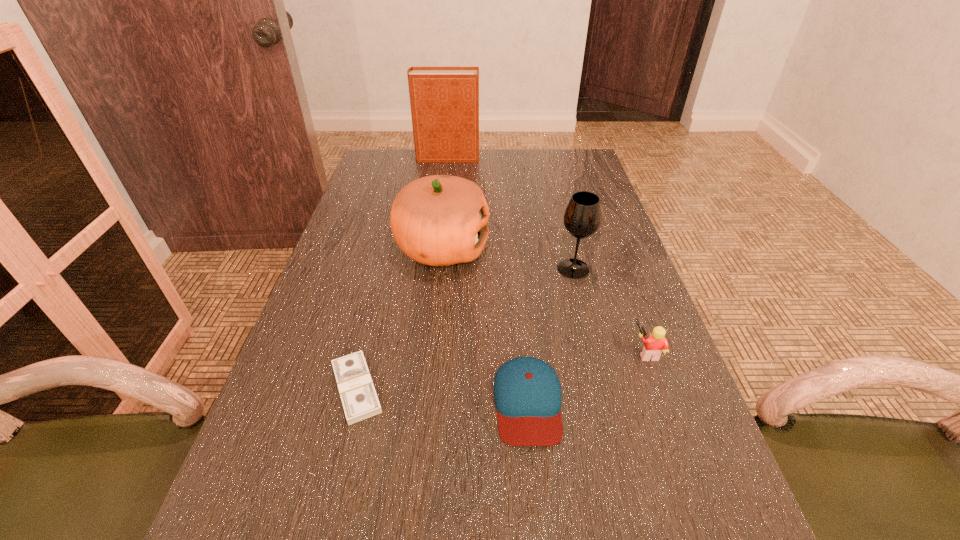
Locate an element on the screen. The image size is (960, 540). dollar located at the left edge is located at coordinates (358, 395).

Where is `wineglass that is at the right edge`? This screenshot has height=540, width=960. wineglass that is at the right edge is located at coordinates (582, 217).

You are a GUI agent. You are given a task and a screenshot of the screen. Output one action in this format:
    pyautogui.click(x=<x>, y=<y>)
    Task: Click on the Lego located at the right edge
    
    Given the screenshot: What is the action you would take?
    pyautogui.click(x=656, y=342)

You are a GUI agent. You are given a task and a screenshot of the screen. Output one action in this format:
    pyautogui.click(x=<x>, y=<y>)
    Task: Click on the object at the far left corner
    This screenshot has width=960, height=540.
    Given the screenshot: What is the action you would take?
    pyautogui.click(x=444, y=101)

Find the location of `vacant point at the far edge`. vacant point at the far edge is located at coordinates (504, 181).

Locate an element on the screen. This screenshot has height=540, width=960. vacant space at the left edge of the desktop is located at coordinates (337, 476).

Where is `vacant point at the right edge`? Image resolution: width=960 pixels, height=540 pixels. vacant point at the right edge is located at coordinates (584, 191).

This screenshot has width=960, height=540. Identify the location of vacant space at the far right corner of the desktop. (566, 158).

This screenshot has height=540, width=960. What are the coordinates of `free spot between the pumpkin and the Lego` in the screenshot? It's located at (544, 300).

This screenshot has height=540, width=960. Find the location of `vacant space that is in between the pumpkin and the baseball cap`. vacant space that is in between the pumpkin and the baseball cap is located at coordinates (485, 325).